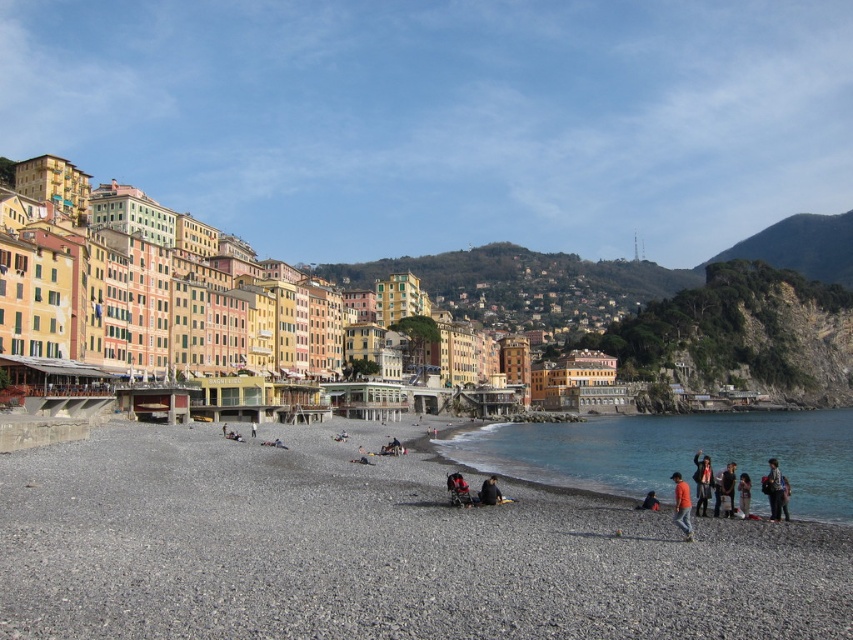
Is point (677, 474) positioned in front of point (695, 484)?

No.

Does orange fabric person at lower right have a larger size compared to dark blue denim jacket at lower right?

No.

Between point (679, 493) and point (701, 499), which one is positioned behind?

The point (701, 499) is behind.

Locate an element on the screen. orange fabric person at lower right is located at coordinates (682, 506).

In the scene shown: Can you confirm if gray gravel beach at lower center is thinner than clear blue water at lower right?

Yes, gray gravel beach at lower center is thinner than clear blue water at lower right.

Is point (827, 573) behind point (767, 433)?

No, it is in front of (767, 433).

Identify the location of gray gravel beach at lower center. This screenshot has height=640, width=853. (373, 548).

Locate an element on the screen. The image size is (853, 640). gray gravel beach at lower center is located at coordinates (373, 548).

Is clear blue water at lower right positioned in front of dark blue denim jacket at lower right?

That is False.

Is clear blue water at lower right below dark blue denim jacket at lower right?

Yes, clear blue water at lower right is below dark blue denim jacket at lower right.

Image resolution: width=853 pixels, height=640 pixels. Describe the element at coordinates (674, 452) in the screenshot. I see `clear blue water at lower right` at that location.

Locate an element on the screen. Image resolution: width=853 pixels, height=640 pixels. clear blue water at lower right is located at coordinates (674, 452).